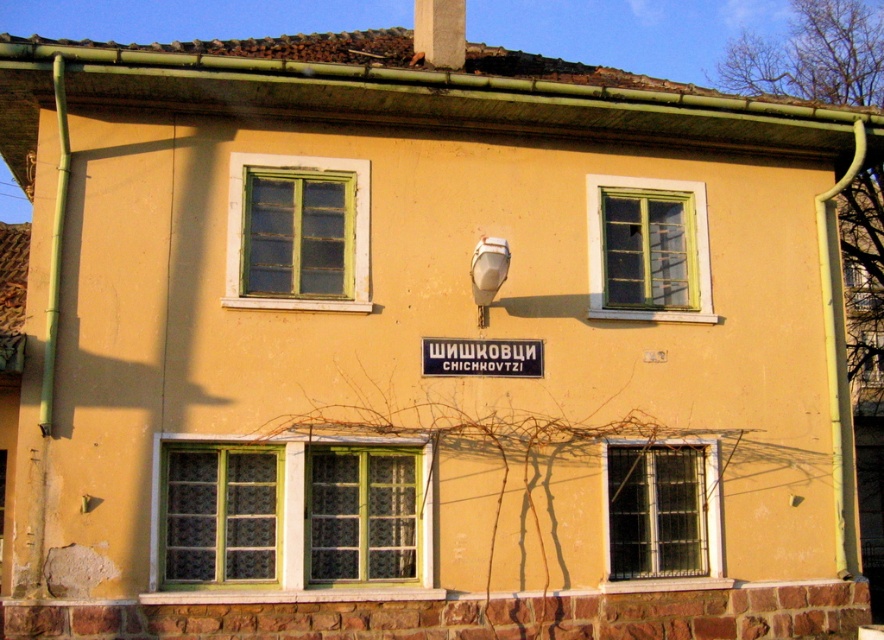
You are an architect evaluating the building facade. You need to determine if the green textured glass window at lower center can accommodate a larger decorative element than the green wooden window at upper right. Based on their sizes, which window has the potential to fit a bigger decoration?

The green textured glass window at lower center has a greater height compared to the green wooden window at upper right, so it can accommodate a larger decorative element.

You are standing in front of the two story building and looking at the signboard between the two upper windows. You want to know where the point at coordinates [290,518] is located. Can you tell me which object this point corresponds to?

The point at coordinates [290,518] corresponds to the green textured glass window at lower center.

You are standing in front of the building and notice the green wooden window at upper right and the black plastic sign at center. Which object is closer to you?

The green wooden window at upper right is closer to you because the black plastic sign at center is behind it.